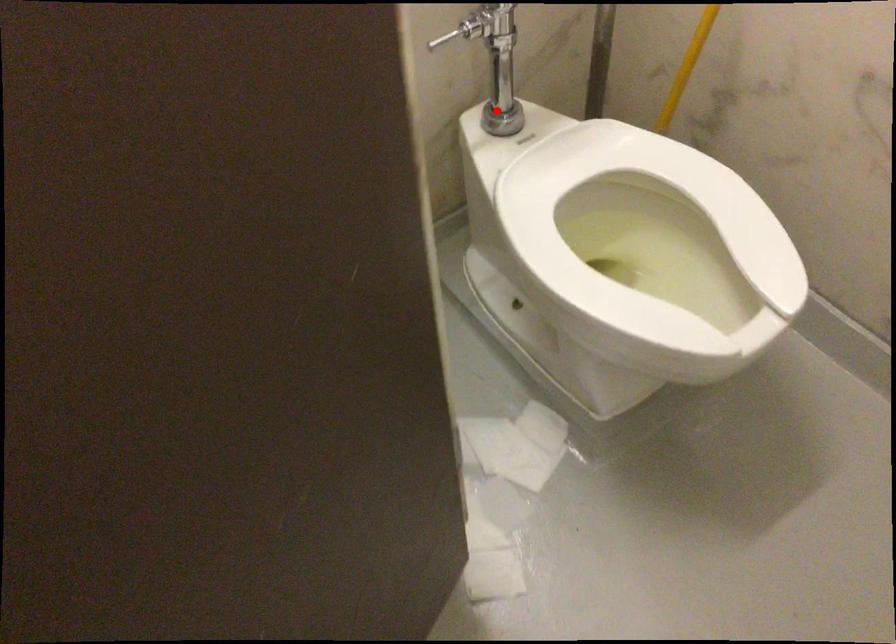
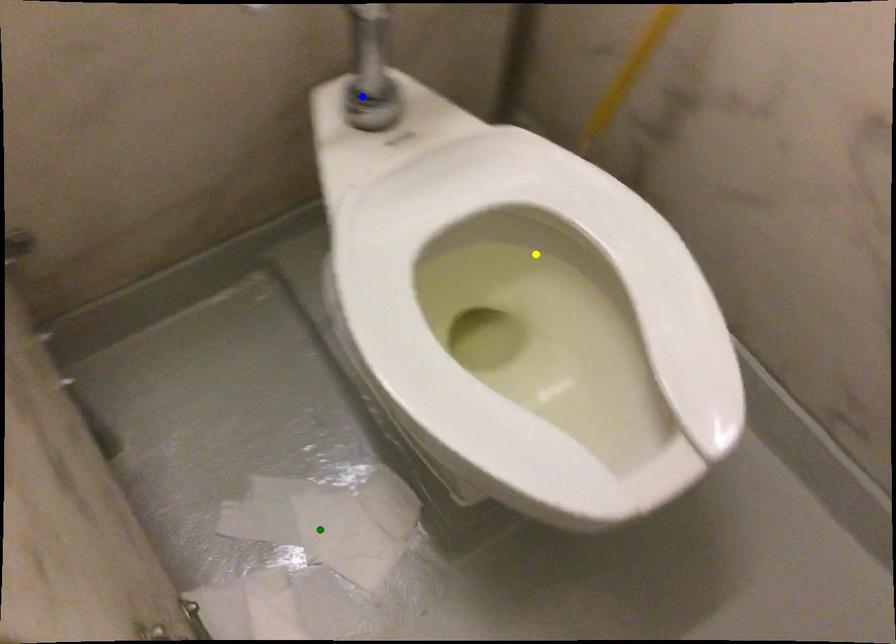
Question: I am providing you with two images of the same scene from different viewpoints. A red point is marked on the first image. You are given multiple points on the second image. Can you choose the point in image 2 that corresponds to the point in image 1?

Choices:
 (A) green point
 (B) yellow point
 (C) blue point

Answer: (C)